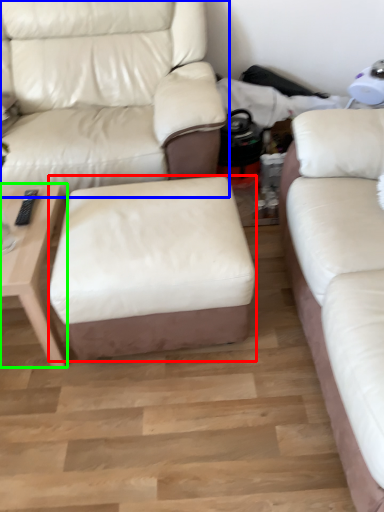
Question: Considering the real-world distances, which object is farthest from stool (highlighted by a red box)? studio couch (highlighted by a blue box) or table (highlighted by a green box)?

Choices:
 (A) studio couch
 (B) table

Answer: (A)